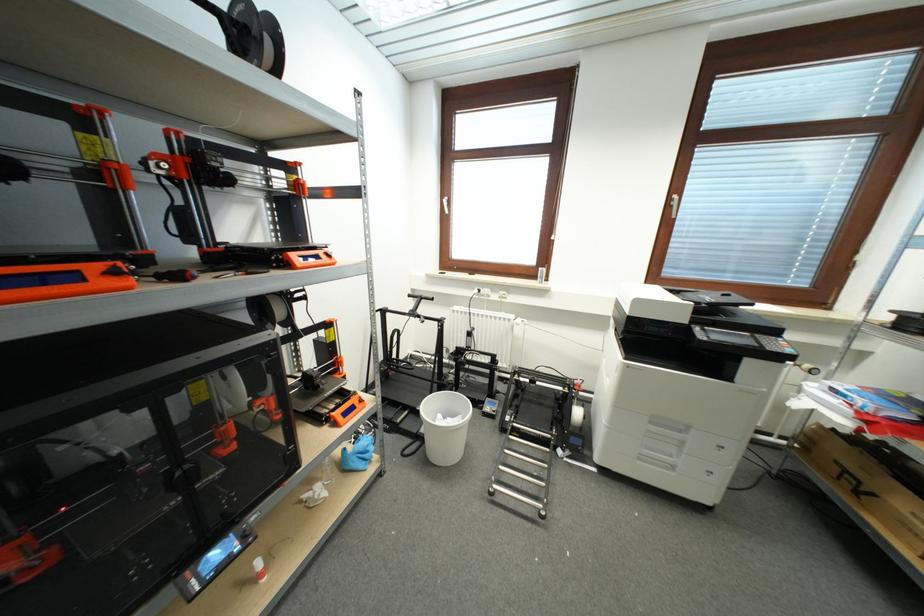
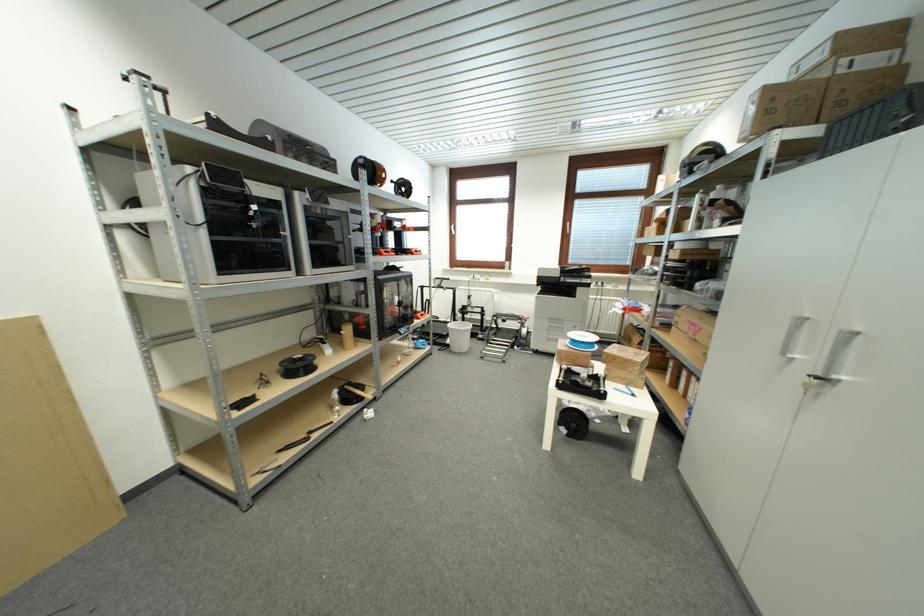
Find the pixel in the second image that matches (x=260, y=39) in the first image.

(408, 190)